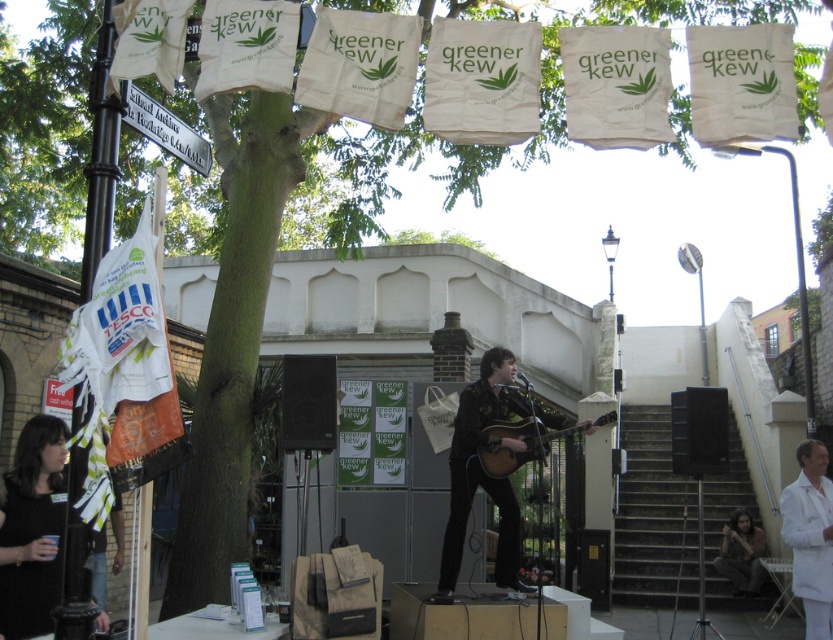
You are a stagehand setting up for a performance. You have two guitars on stage, a matte black guitar at center and an acoustic wood guitar at center. The stage has a limited space between the speakers on either side. Which guitar might require more space between the speakers to avoid touching them?

The matte black guitar at center might require more space between the speakers since it is wider than the acoustic wood guitar at center.

You are a photographer positioned at the camera. You want to capture a closeup shot of the matte black guitar at center. Given that you can only move forward or backward along the path between you and the guitar, can you get close enough to fill the frame with the guitar?

The matte black guitar at center and camera are 5.88 meters apart from each other. Since you can move along the path, you can adjust your position closer to the guitar to fill the frame, as 5.88 meters is a manageable distance for a photographer to move closer.

You are standing at the center of the stage where the performer is singing. You want to move towards the point that is closer to you. Which point should you move towards, point (1, 627) or point (450, 500)?

You should move towards point (1, 627) because it is closer to the viewer than point (450, 500).